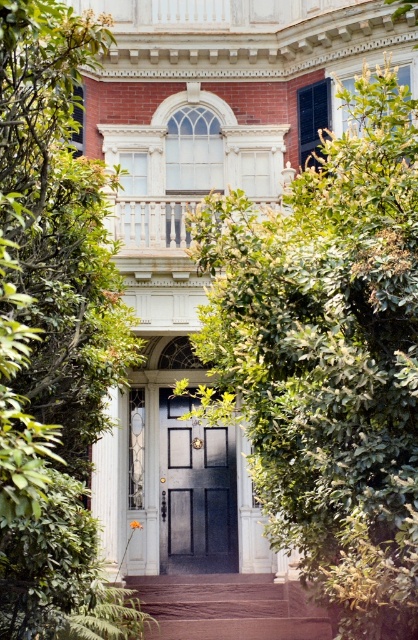
Does green leafy bush at center have a smaller size compared to matte black door at center?

Incorrect, green leafy bush at center is not smaller in size than matte black door at center.

Who is taller, green leafy bush at center or matte black door at center?

Standing taller between the two is green leafy bush at center.

Does point (415, 461) come in front of point (163, 500)?

Yes.

Find the location of a particular element. green leafy bush at center is located at coordinates (328, 356).

Who is positioned more to the left, green leafy bush at center or brown stone stairs at center?

Positioned to the left is brown stone stairs at center.

Does point (310, 548) come closer to viewer compared to point (198, 636)?

Yes, point (310, 548) is closer to viewer.

The height and width of the screenshot is (640, 418). Identify the location of green leafy bush at center. (328, 356).

Does matte black door at center have a lesser width compared to brown stone stairs at center?

Yes, matte black door at center is thinner than brown stone stairs at center.

Between matte black door at center and brown stone stairs at center, which one has more height?

Standing taller between the two is matte black door at center.

Which is behind, point (175, 417) or point (193, 573)?

The point (175, 417) is behind.

The height and width of the screenshot is (640, 418). What are the coordinates of `matte black door at center` in the screenshot? It's located at (196, 492).